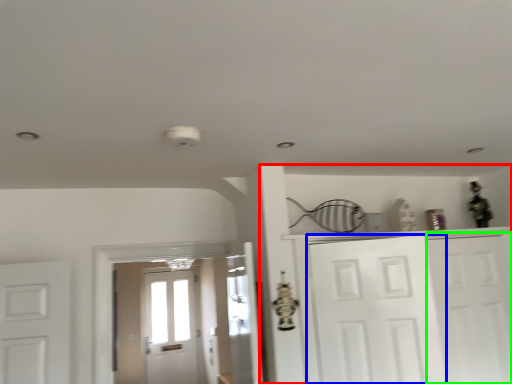
Question: Considering the real-world distances, which object is closest to dresser (highlighted by a red box)? door (highlighted by a blue box) or door (highlighted by a green box).

Choices:
 (A) door
 (B) door

Answer: (A)